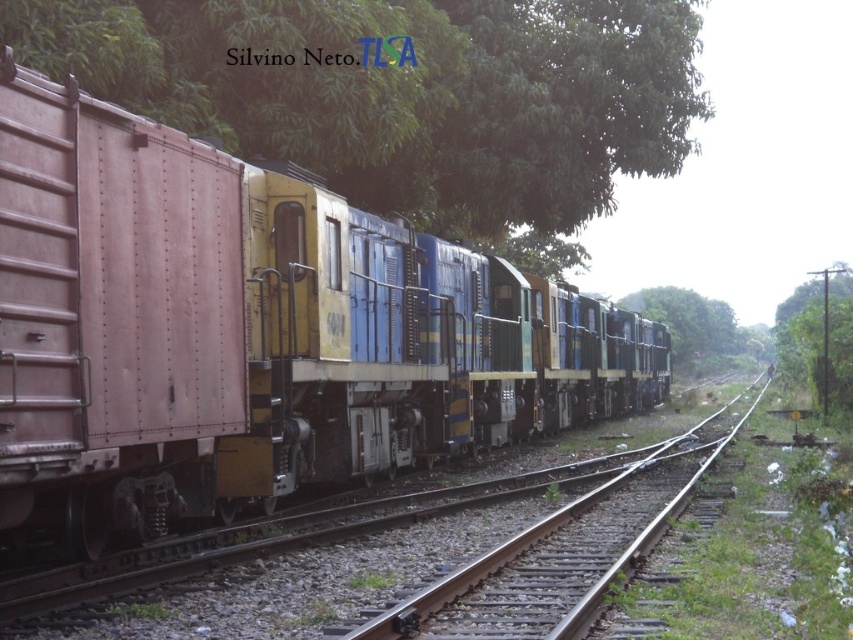
Question: Is brown metal train track at center closer to camera compared to green leafy tree at right?

Choices:
 (A) yes
 (B) no

Answer: (A)

Question: Is rusty metal train car at left above green leafy tree at upper center?

Choices:
 (A) no
 (B) yes

Answer: (A)

Question: Which object appears closest to the camera in this image?

Choices:
 (A) rusty metal train car at left
 (B) green leafy tree at right

Answer: (A)

Question: Which is nearer to the green leafy tree at upper center?

Choices:
 (A) brown metal train track at center
 (B) green leafy tree at center

Answer: (A)

Question: Can you confirm if green leafy tree at upper center is bigger than brown metal train track at center?

Choices:
 (A) no
 (B) yes

Answer: (B)

Question: Based on their relative distances, which object is farther from the green leafy tree at right?

Choices:
 (A) green leafy tree at upper center
 (B) green leafy tree at center
 (C) brown metal train track at center

Answer: (C)